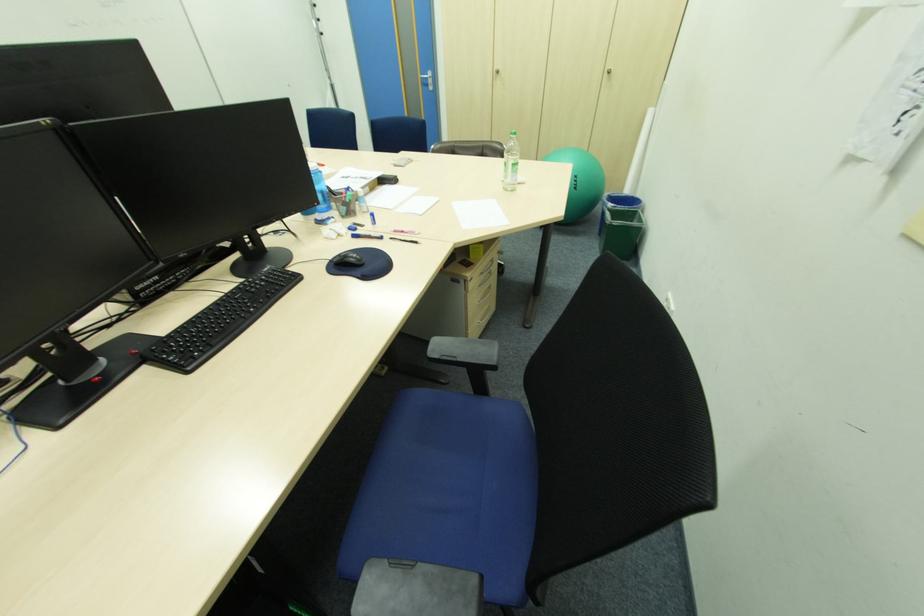
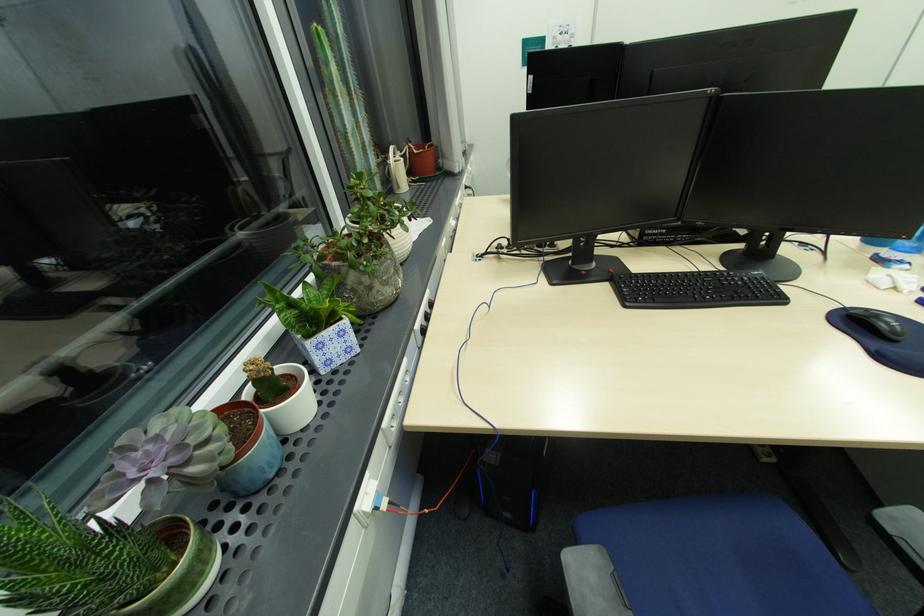
Locate, in the second image, the point that corresponds to [335,262] in the first image.

(849, 310)